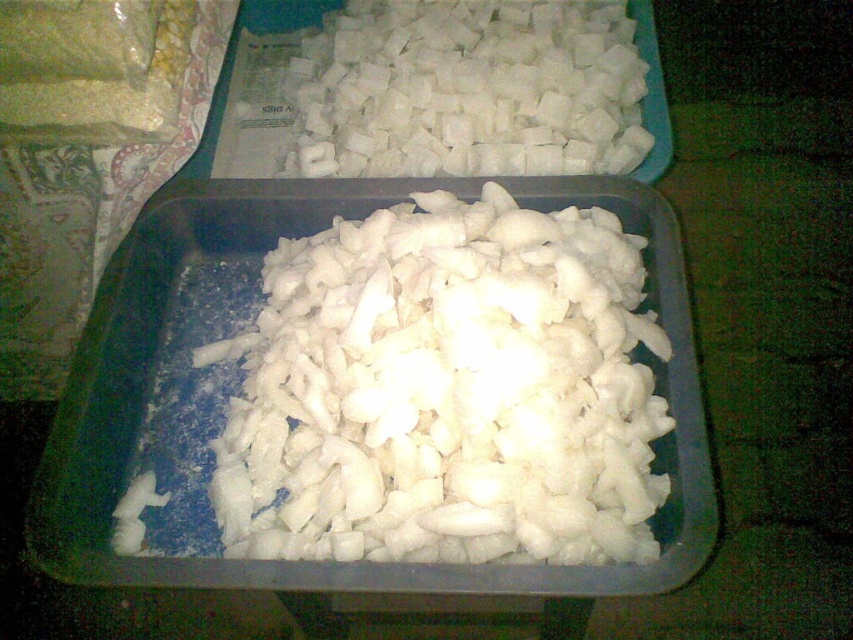
Question: Is white matte chopped onions at center below white sugar cubes at upper center?

Choices:
 (A) no
 (B) yes

Answer: (B)

Question: Does white matte chopped onions at center have a lesser width compared to white sugar cubes at upper center?

Choices:
 (A) no
 (B) yes

Answer: (A)

Question: Does white matte chopped onions at center come in front of white sugar cubes at upper center?

Choices:
 (A) yes
 (B) no

Answer: (A)